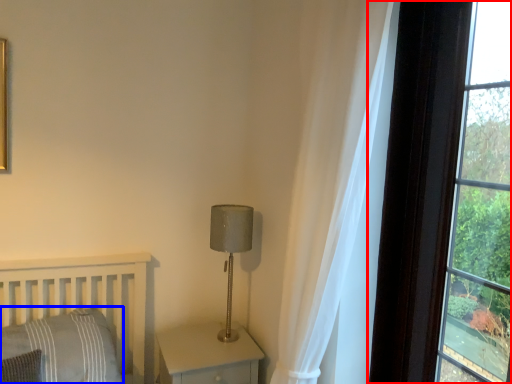
Question: Which object appears farthest to the camera in this image, window (highlighted by a red box) or pillow (highlighted by a blue box)?

Choices:
 (A) window
 (B) pillow

Answer: (B)